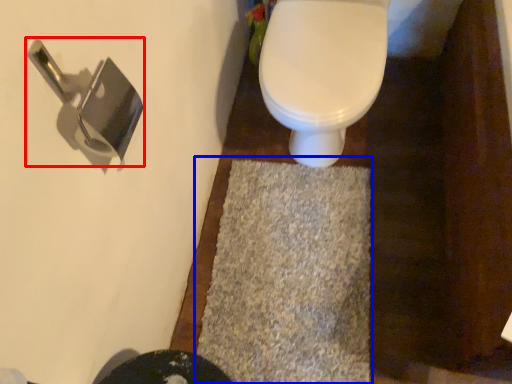
Question: Which object is further to the camera taking this photo, door handle (highlighted by a red box) or bath mat (highlighted by a blue box)?

Choices:
 (A) door handle
 (B) bath mat

Answer: (B)